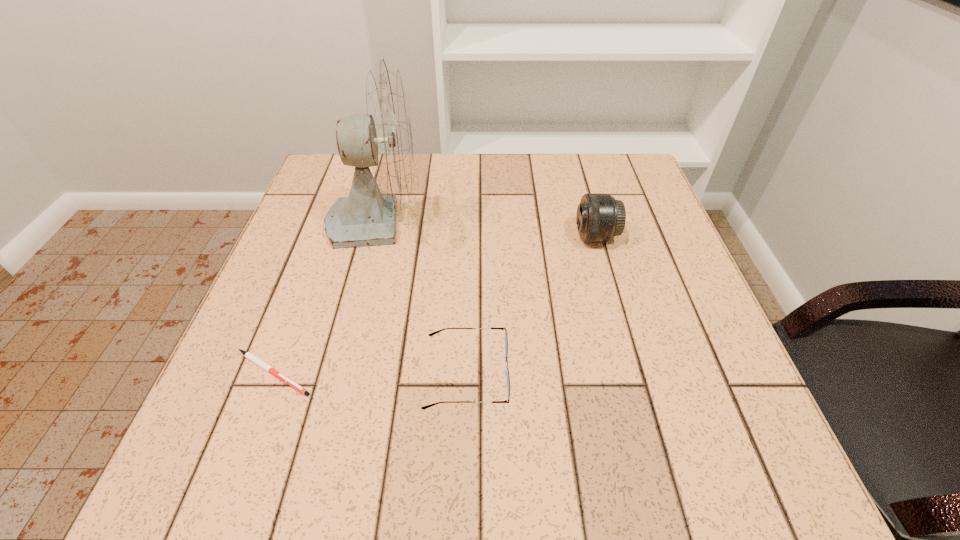
Locate an element on the screen. The width and height of the screenshot is (960, 540). fan is located at coordinates (x=382, y=139).

Identify the location of the third shortest object. This screenshot has height=540, width=960. (600, 217).

This screenshot has width=960, height=540. I want to click on telephoto lens, so click(x=600, y=217).

I want to click on the second object from right to left, so click(431, 334).

Locate an element on the screen. The image size is (960, 540). spectacles is located at coordinates (431, 334).

The height and width of the screenshot is (540, 960). Find the location of `pen`. pen is located at coordinates (248, 355).

Where is `free spot located 0.140m in front of the fan to blow air`? free spot located 0.140m in front of the fan to blow air is located at coordinates (482, 220).

Find the location of `free space located 0.340m on the front-facing side of the rightmost object`. free space located 0.340m on the front-facing side of the rightmost object is located at coordinates (427, 237).

Find the location of `vacant space located 0.390m on the front-facing side of the rightmost object`. vacant space located 0.390m on the front-facing side of the rightmost object is located at coordinates (405, 237).

What are the coordinates of `vacant space located 0.100m on the front-facing side of the rightmost object` in the screenshot? It's located at (532, 237).